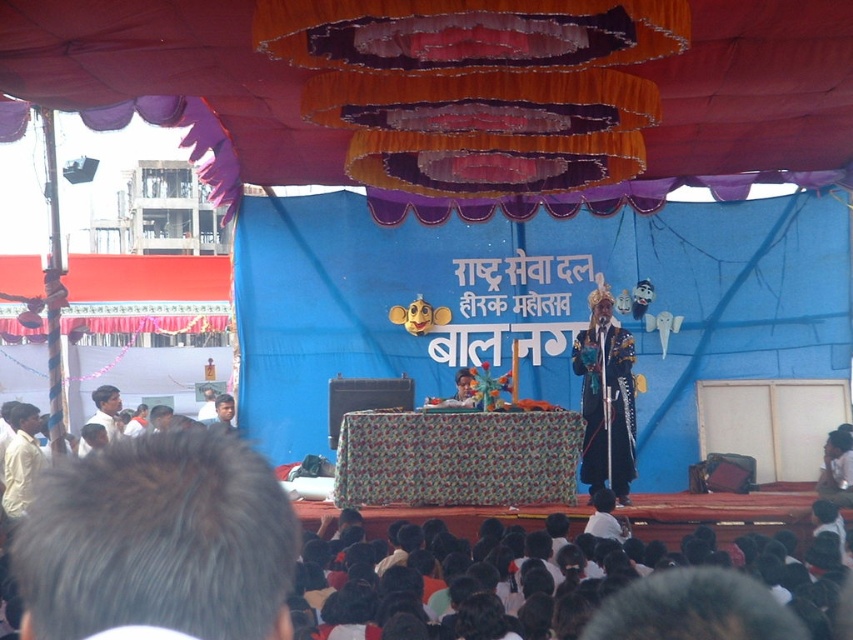
Does black fabric at lower center appear on the right side of shiny blue costume at center?

In fact, black fabric at lower center is to the left of shiny blue costume at center.

Between point (463, 628) and point (619, 392), which one is positioned behind?

Point (619, 392)

Locate an element on the screen. black fabric at lower center is located at coordinates (566, 573).

Identify the location of black fabric at lower center. This screenshot has width=853, height=640. (566, 573).

What do you see at coordinates (169, 74) in the screenshot?
I see `textured fabric canopy at upper center` at bounding box center [169, 74].

Who is more distant from viewer, (13, 3) or (514, 573)?

Point (13, 3)

Image resolution: width=853 pixels, height=640 pixels. Identify the location of textured fabric canopy at upper center. (169, 74).

Is textured fabric canopy at upper center positioned before shiny blue costume at center?

Yes, it is in front of shiny blue costume at center.

Who is positioned more to the right, textured fabric canopy at upper center or shiny blue costume at center?

shiny blue costume at center is more to the right.

Measure the distance between point (245, 26) and camera.

They are 58.03 meters apart.

I want to click on textured fabric canopy at upper center, so click(169, 74).